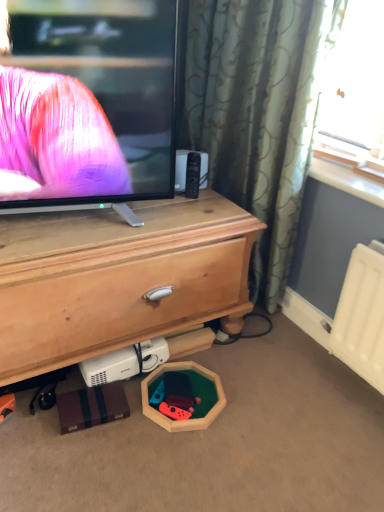
The image size is (384, 512). I want to click on vacant area located to the right-hand side of wooden hexagon at lower center, which ranks as the second toy in left-to-right order, so click(256, 407).